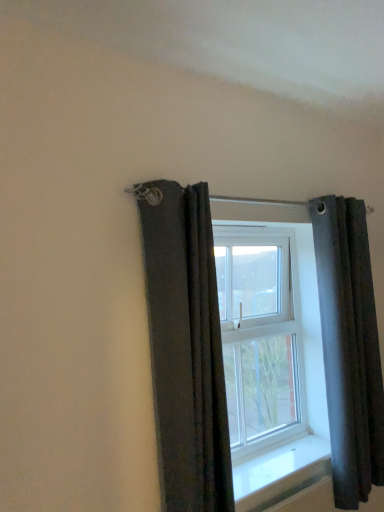
Question: Is white glossy window sill at center taller than dark gray fabric curtain at right, marked as the first curtain in a back-to-front arrangement?

Choices:
 (A) yes
 (B) no

Answer: (B)

Question: From a real-world perspective, is white glossy window sill at center positioned over dark gray fabric curtain at right, marked as the first curtain in a back-to-front arrangement, based on gravity?

Choices:
 (A) yes
 (B) no

Answer: (B)

Question: Is white glossy window sill at center surrounding dark gray fabric curtain at right, marked as the first curtain in a back-to-front arrangement?

Choices:
 (A) yes
 (B) no

Answer: (B)

Question: Does white glossy window sill at center have a smaller size compared to dark gray fabric curtain at right, which is the 2th curtain in left-to-right order?

Choices:
 (A) yes
 (B) no

Answer: (A)

Question: Considering the relative sizes of white glossy window sill at center and dark gray fabric curtain at right, which is the 2th curtain in left-to-right order, in the image provided, is white glossy window sill at center bigger than dark gray fabric curtain at right, which is the 2th curtain in left-to-right order,?

Choices:
 (A) no
 (B) yes

Answer: (A)

Question: From the image's perspective, does white glossy window sill at center appear higher than dark gray fabric curtain at right, marked as the first curtain in a back-to-front arrangement?

Choices:
 (A) no
 (B) yes

Answer: (A)

Question: Is dark gray fabric curtain at right, the 1th curtain positioned from the right, to the right of dark gray fabric curtain at upper left, the 1th curtain when ordered from left to right, from the viewer's perspective?

Choices:
 (A) no
 (B) yes

Answer: (B)

Question: Are dark gray fabric curtain at right, marked as the first curtain in a back-to-front arrangement, and dark gray fabric curtain at upper left, the 1th curtain when ordered from left to right, located far from each other?

Choices:
 (A) no
 (B) yes

Answer: (A)

Question: Is dark gray fabric curtain at right, positioned as the second curtain in front-to-back order, facing away from dark gray fabric curtain at upper left, the 1th curtain when ordered from left to right?

Choices:
 (A) yes
 (B) no

Answer: (B)

Question: From a real-world perspective, is dark gray fabric curtain at right, the 1th curtain positioned from the right, below dark gray fabric curtain at upper left, acting as the first curtain starting from the front?

Choices:
 (A) no
 (B) yes

Answer: (B)

Question: From a real-world perspective, is dark gray fabric curtain at right, the 1th curtain positioned from the right, on top of dark gray fabric curtain at upper left, acting as the first curtain starting from the front?

Choices:
 (A) no
 (B) yes

Answer: (A)

Question: Is dark gray fabric curtain at upper left, arranged as the second curtain when viewed from the right, inside dark gray fabric curtain at right, which is the 2th curtain in left-to-right order?

Choices:
 (A) no
 (B) yes

Answer: (A)

Question: Is white glossy window sill at center outside dark gray fabric curtain at upper left, acting as the first curtain starting from the front?

Choices:
 (A) yes
 (B) no

Answer: (A)